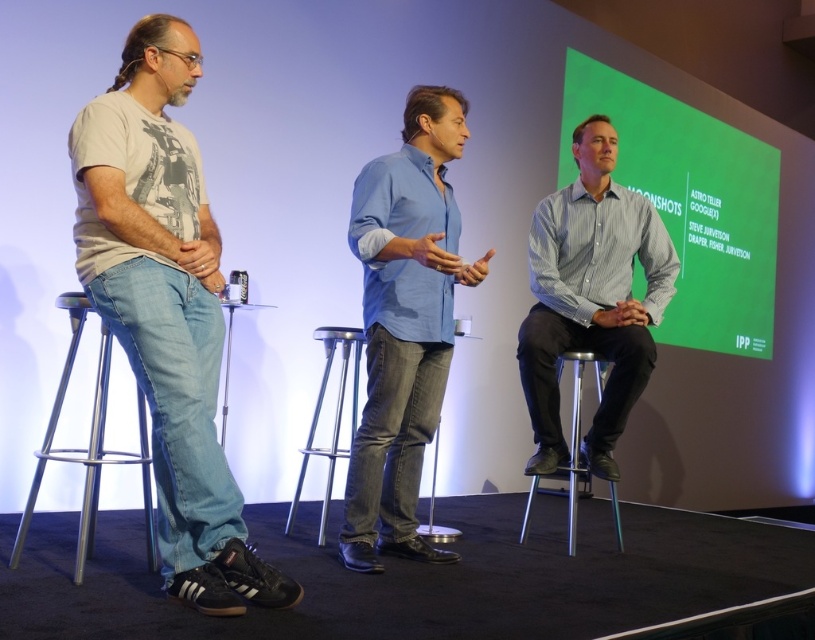
You are sitting on the silver metallic bar stool at left and want to look at the green matte projection screen at upper center. Is the screen blocking your view of anything behind it?

The silver metallic bar stool at left is behind the green matte projection screen at upper center, so the screen is in front of the stool. This means the screen would block your view of anything behind it, but since you are sitting on the stool, you would be looking forward, not backward. Therefore, the screen itself is what you see directly in front of you.

You are an event planner setting up the stage for a panel discussion. You need to ensure that all participants can be seen clearly by the audience. Given the blue denim jeans at center and the silver metallic bar stool at left, which object is taller and might block the view if placed in front of the stage?

The blue denim jeans at center is taller than the silver metallic bar stool at left, so it would block the view more if placed in front of the stage.

You are an attendee at this event and want to take a photo of the green matte projection screen at upper center without including the silver metallic bar stool at left in the frame. Is this possible given their positions?

The green matte projection screen at upper center is positioned over the silver metallic bar stool at left, so taking a photo of the screen without the stool would require angling the camera to exclude the stool beneath it.